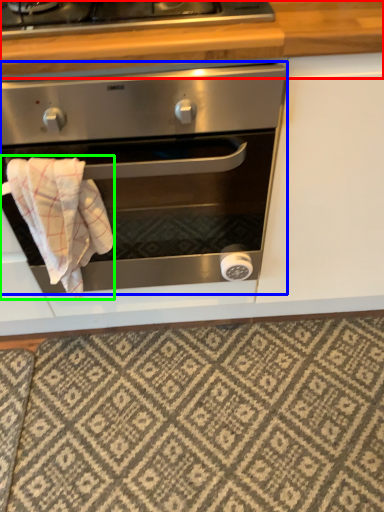
Question: Which object is positioned farthest from counter top (highlighted by a red box)? Select from oven (highlighted by a blue box) and bath towel (highlighted by a green box).

Choices:
 (A) oven
 (B) bath towel

Answer: (B)